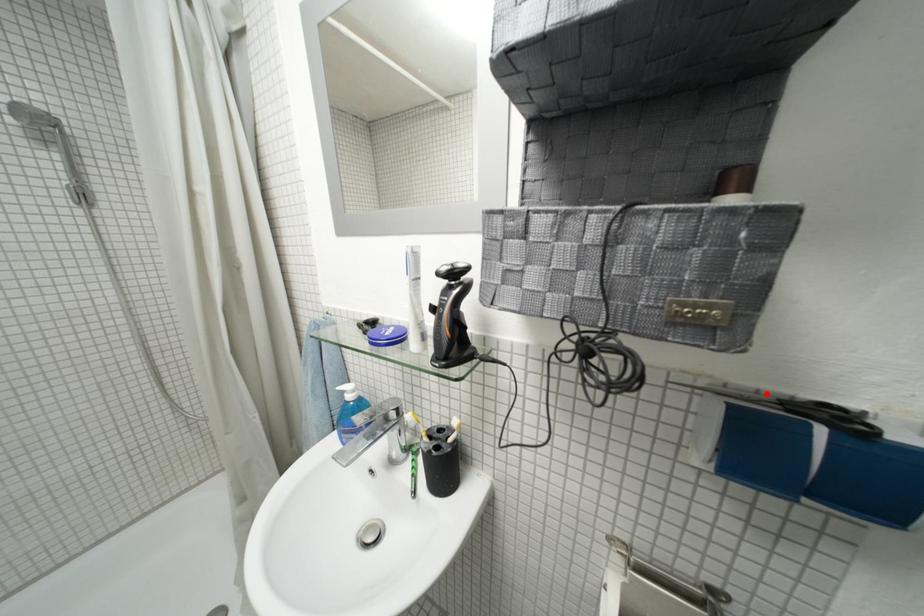
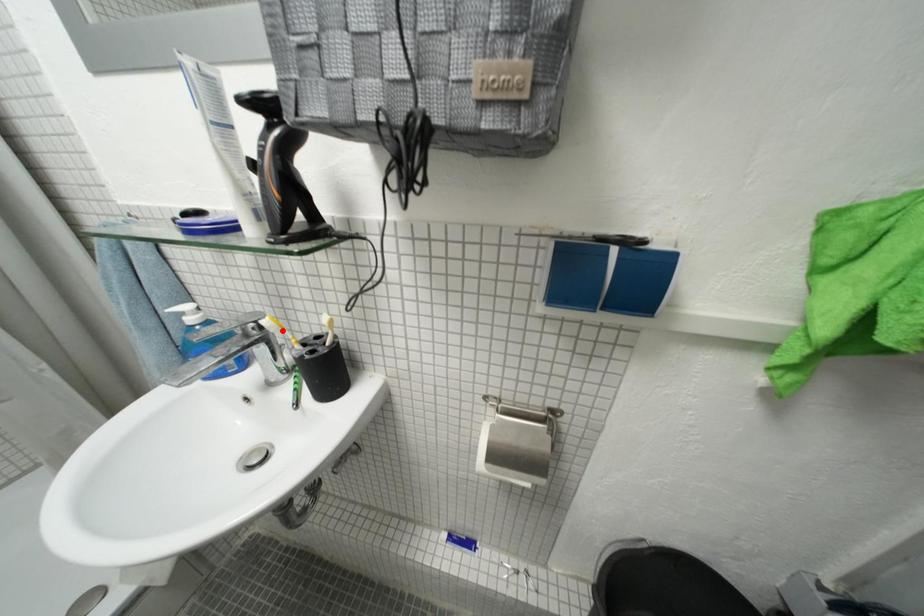
I am providing you with two images of the same scene from different viewpoints. A red point is marked on the first image and another point is marked on the second image. Is the red point in image1 aligned with the point shown in image2?

No